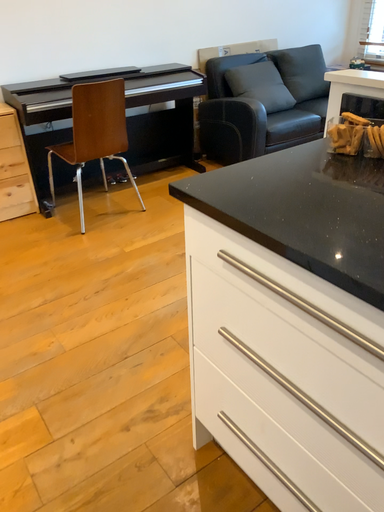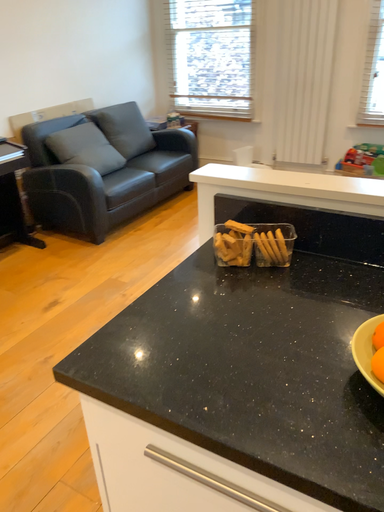
Question: Which way did the camera rotate in the video?

Choices:
 (A) rotated downward
 (B) rotated upward

Answer: (B)